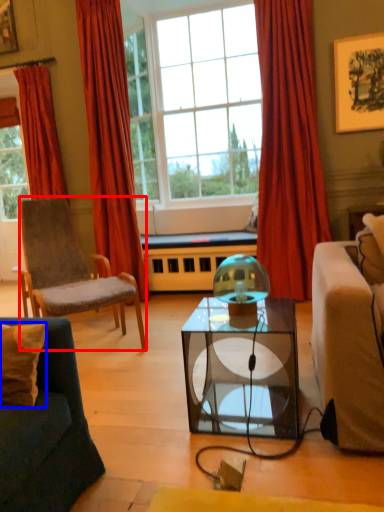
Question: Which object is further to the camera taking this photo, chair (highlighted by a red box) or pillow (highlighted by a blue box)?

Choices:
 (A) chair
 (B) pillow

Answer: (A)